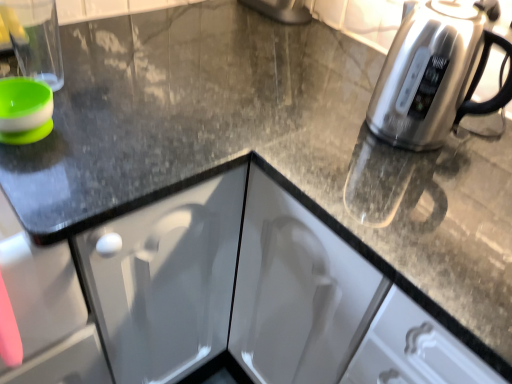
The height and width of the screenshot is (384, 512). In order to click on vacant region in front of satin silver kettle at right in this screenshot , I will do `click(414, 203)`.